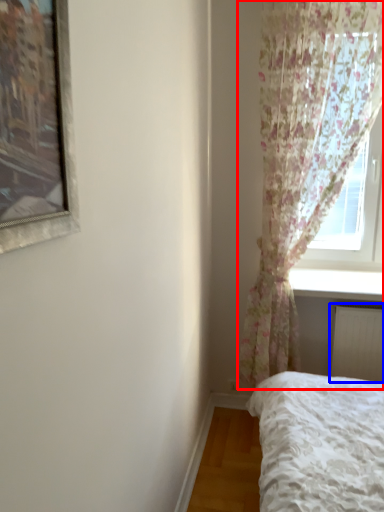
Question: Which object appears farthest to the camera in this image, curtain (highlighted by a red box) or radiator (highlighted by a blue box)?

Choices:
 (A) curtain
 (B) radiator

Answer: (B)